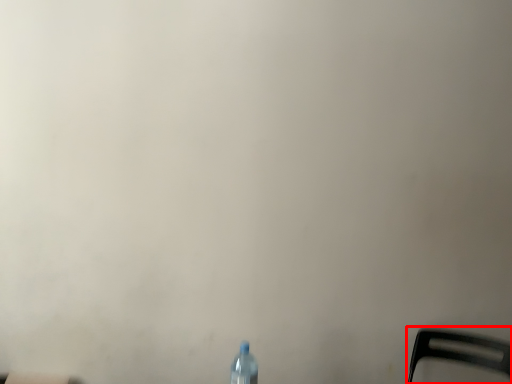
Question: From the image's perspective, what is the correct spatial positioning of chair (annotated by the red box) in reference to bottle?

Choices:
 (A) below
 (B) above

Answer: (A)